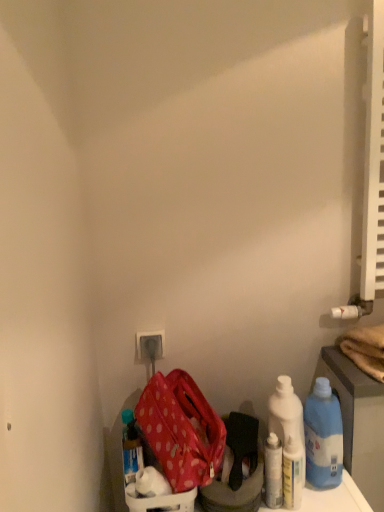
Question: From the image's perspective, is white glossy bottle at lower right, acting as the second bottle starting from the right, below white plastic electric outlet at lower center?

Choices:
 (A) no
 (B) yes

Answer: (B)

Question: Can you confirm if white glossy bottle at lower right, acting as the second bottle starting from the right, is smaller than white plastic electric outlet at lower center?

Choices:
 (A) yes
 (B) no

Answer: (B)

Question: Considering the relative sizes of white glossy bottle at lower right, placed as the third bottle when sorted from left to right, and white plastic electric outlet at lower center in the image provided, is white glossy bottle at lower right, placed as the third bottle when sorted from left to right, wider than white plastic electric outlet at lower center?

Choices:
 (A) no
 (B) yes

Answer: (B)

Question: Considering the relative sizes of white glossy bottle at lower right, acting as the second bottle starting from the right, and white plastic electric outlet at lower center in the image provided, is white glossy bottle at lower right, acting as the second bottle starting from the right, taller than white plastic electric outlet at lower center?

Choices:
 (A) yes
 (B) no

Answer: (A)

Question: Are white glossy bottle at lower right, placed as the third bottle when sorted from left to right, and white plastic electric outlet at lower center far apart?

Choices:
 (A) no
 (B) yes

Answer: (A)

Question: Do you think polka dot fabric bag at lower left is within white plastic electric outlet at lower center, or outside of it?

Choices:
 (A) outside
 (B) inside

Answer: (A)

Question: Is point (208, 437) positioned closer to the camera than point (157, 343)?

Choices:
 (A) farther
 (B) closer

Answer: (B)

Question: From a real-world perspective, is polka dot fabric bag at lower left physically located above or below white plastic electric outlet at lower center?

Choices:
 (A) below
 (B) above

Answer: (A)

Question: Relative to white plastic electric outlet at lower center, is polka dot fabric bag at lower left in front or behind?

Choices:
 (A) behind
 (B) front

Answer: (B)

Question: Looking at the image, does white glossy bottle at lower right, placed as the third bottle when sorted from left to right, seem bigger or smaller compared to white plastic electric outlet at lower center?

Choices:
 (A) small
 (B) big

Answer: (B)

Question: From a real-world perspective, is white glossy bottle at lower right, acting as the second bottle starting from the right, physically located above or below white plastic electric outlet at lower center?

Choices:
 (A) above
 (B) below

Answer: (B)

Question: From the image's perspective, relative to white plastic electric outlet at lower center, is white glossy bottle at lower right, placed as the third bottle when sorted from left to right, above or below?

Choices:
 (A) below
 (B) above

Answer: (A)

Question: Is point (289, 458) positioned closer to the camera than point (144, 351)?

Choices:
 (A) farther
 (B) closer

Answer: (B)

Question: Is white glossy bottle at lower right, marked as the third bottle in a right-to-left arrangement, to the left or to the right of white plastic electric outlet at lower center in the image?

Choices:
 (A) left
 (B) right

Answer: (B)

Question: From the image's perspective, is white glossy bottle at lower right, arranged as the 2th bottle when viewed from the left, positioned above or below white plastic electric outlet at lower center?

Choices:
 (A) above
 (B) below

Answer: (B)